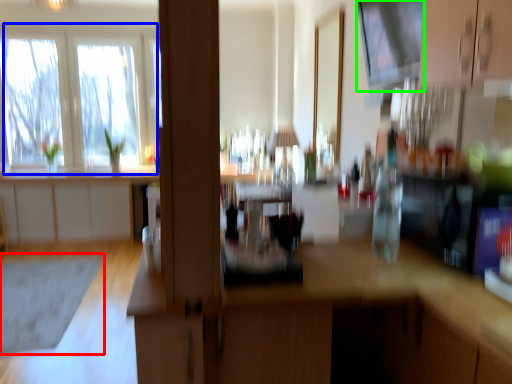
Question: Which object is positioned closest to mat (highlighted by a red box)? Select from window (highlighted by a blue box) and window screen (highlighted by a green box).

Choices:
 (A) window
 (B) window screen

Answer: (A)